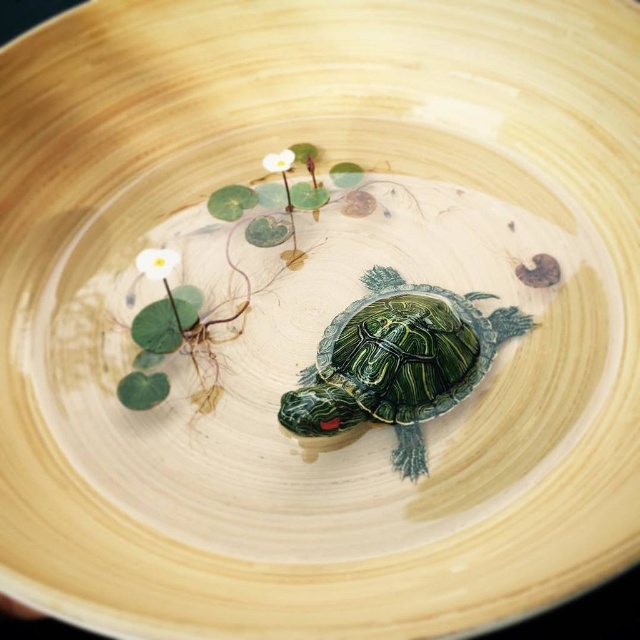
Question: Is green leafy plant at center further to the viewer compared to white matte flower at upper left?

Choices:
 (A) yes
 (B) no

Answer: (B)

Question: Estimate the real-world distances between objects in this image. Which object is farther from the white matte flower at upper left?

Choices:
 (A) white matte flower at upper center
 (B) green leafy plant at center
 (C) shiny green tortoise at center

Answer: (C)

Question: Estimate the real-world distances between objects in this image. Which object is farther from the white matte flower at upper left?

Choices:
 (A) white matte flower at upper center
 (B) green leafy plant at center

Answer: (A)

Question: Is shiny green tortoise at center to the left of green leafy plant at center from the viewer's perspective?

Choices:
 (A) no
 (B) yes

Answer: (A)

Question: In this image, where is green leafy plant at center located relative to white matte flower at upper center?

Choices:
 (A) left
 (B) right

Answer: (A)

Question: Which point is closer to the camera?

Choices:
 (A) (282, 170)
 (B) (141, 388)
 (C) (164, 269)
 (D) (419, 452)

Answer: (D)